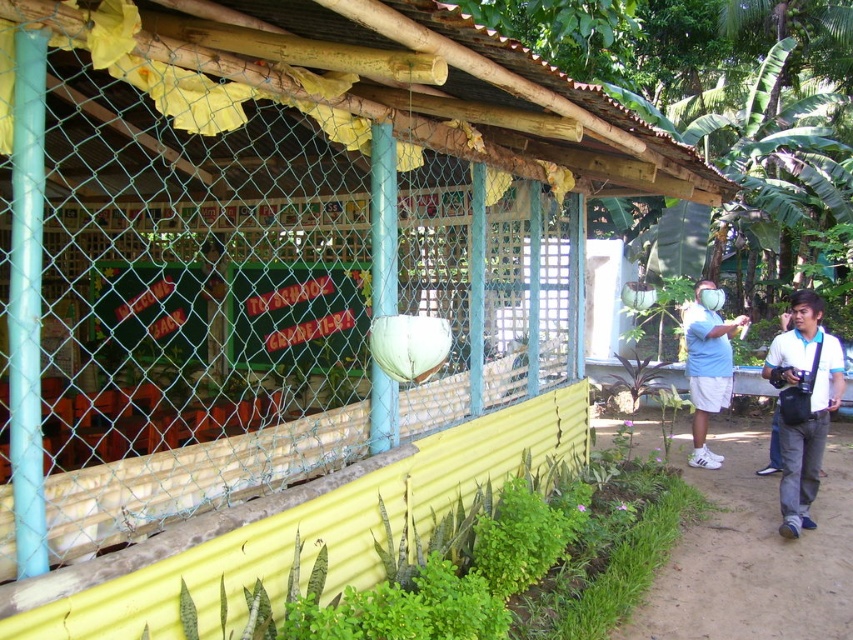
Question: Which object is positioned farthest from the brown dirt path at lower right?

Choices:
 (A) white matte shirt at right
 (B) white cotton shirt at right

Answer: (A)

Question: Which of the following is the closest to the observer?

Choices:
 (A) white matte shirt at right
 (B) white cotton shirt at right

Answer: (B)

Question: Which point is farther from the camera taking this photo?

Choices:
 (A) (689, 364)
 (B) (788, 346)

Answer: (A)

Question: Can you confirm if brown dirt path at lower right is positioned below white matte shirt at right?

Choices:
 (A) yes
 (B) no

Answer: (A)

Question: Is brown dirt path at lower right bigger than white matte shirt at right?

Choices:
 (A) yes
 (B) no

Answer: (B)

Question: Can you confirm if brown dirt path at lower right is thinner than white matte shirt at right?

Choices:
 (A) yes
 (B) no

Answer: (B)